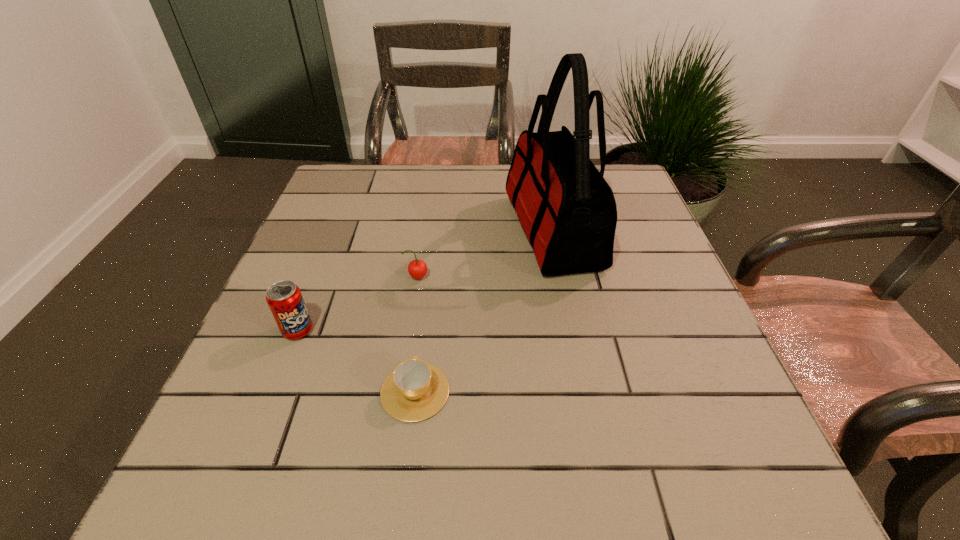
At what (x,y) coordinates should I click in order to perform the action: click on vacant point at the right edge. Please return your answer as a coordinate pair (x, y). Looking at the image, I should click on (633, 212).

The height and width of the screenshot is (540, 960). Identify the location of vacant space at the far right corner of the desktop. (620, 178).

This screenshot has height=540, width=960. I want to click on free space that is in between the second nearest object and the rightmost object, so click(425, 280).

Locate an element on the screen. This screenshot has height=540, width=960. free space between the duffel bag and the nearest object is located at coordinates click(x=484, y=311).

What are the coordinates of `vacant area that lies between the rightmost object and the second shortest object` in the screenshot? It's located at (485, 254).

The height and width of the screenshot is (540, 960). I want to click on vacant area between the third shortest object and the nearest object, so click(356, 361).

You are a GUI agent. You are given a task and a screenshot of the screen. Output one action in this format:
    pyautogui.click(x=<x>, y=<y>)
    Task: Click on the free spot between the soda can and the third tallest object
    The width and height of the screenshot is (960, 540).
    Given the screenshot: What is the action you would take?
    pyautogui.click(x=358, y=304)

Where is `empty space between the third tallest object and the rightmost object`? Image resolution: width=960 pixels, height=540 pixels. empty space between the third tallest object and the rightmost object is located at coordinates (485, 254).

Where is `vacant area between the tallest object and the third tallest object`? Image resolution: width=960 pixels, height=540 pixels. vacant area between the tallest object and the third tallest object is located at coordinates (485, 254).

You are a GUI agent. You are given a task and a screenshot of the screen. Output one action in this format:
    pyautogui.click(x=<x>, y=<y>)
    Task: Click on the free space that is in between the cherry and the tallest object
    The image size is (960, 540).
    Given the screenshot: What is the action you would take?
    pyautogui.click(x=485, y=254)